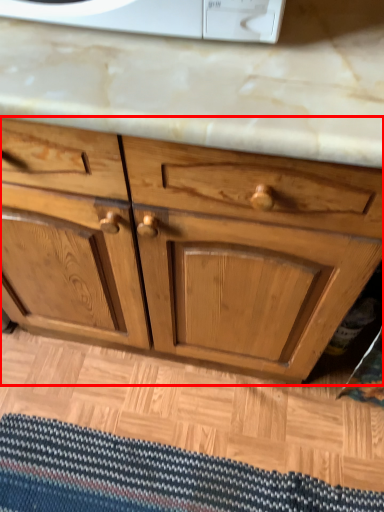
Question: From the image's perspective, considering the relative positions of chest of drawers (annotated by the red box) and doormat in the image provided, where is chest of drawers (annotated by the red box) located with respect to the staircase?

Choices:
 (A) above
 (B) below

Answer: (A)